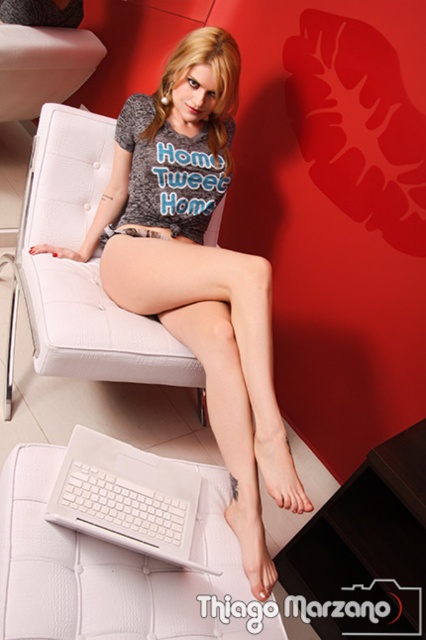
You are standing in the room and want to place a small decorative item between the two points labeled point [285,464] and point [111,484]. Which point should you place it closer to in order for it to be in front of the other point?

To place the decorative item in front of both points, you should position it closer to point [111,484] since it is in front of point [285,464].